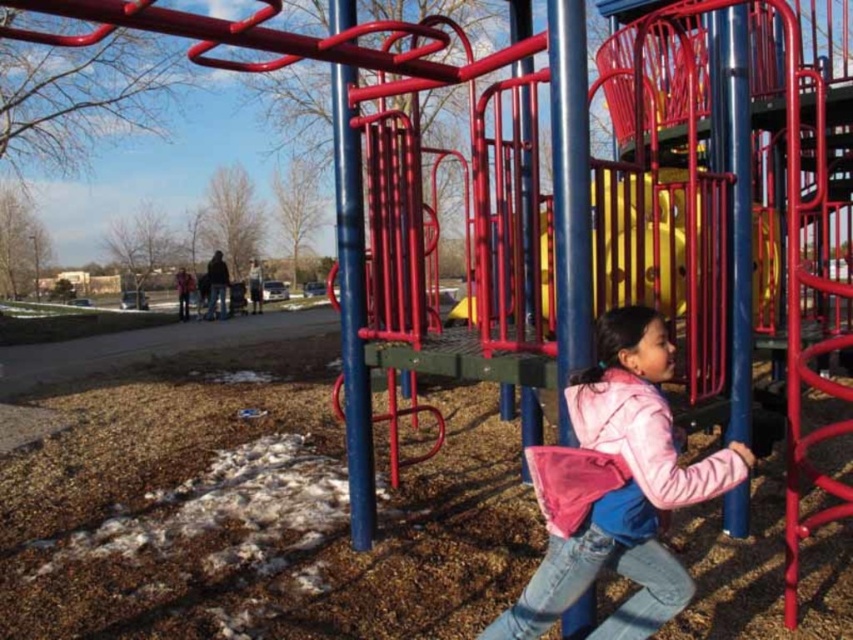
Question: Which point is closer to the camera?

Choices:
 (A) yellow plastic slide at center
 (B) pink fleece jacket at center

Answer: (B)

Question: Is the position of pink fleece jacket at center less distant than that of yellow plastic slide at center?

Choices:
 (A) no
 (B) yes

Answer: (B)

Question: Can you confirm if pink fleece jacket at center is smaller than yellow plastic slide at center?

Choices:
 (A) no
 (B) yes

Answer: (B)

Question: Among these objects, which one is nearest to the camera?

Choices:
 (A) yellow plastic slide at center
 (B) pink fleece jacket at center

Answer: (B)

Question: Is pink fleece jacket at center bigger than yellow plastic slide at center?

Choices:
 (A) no
 (B) yes

Answer: (A)